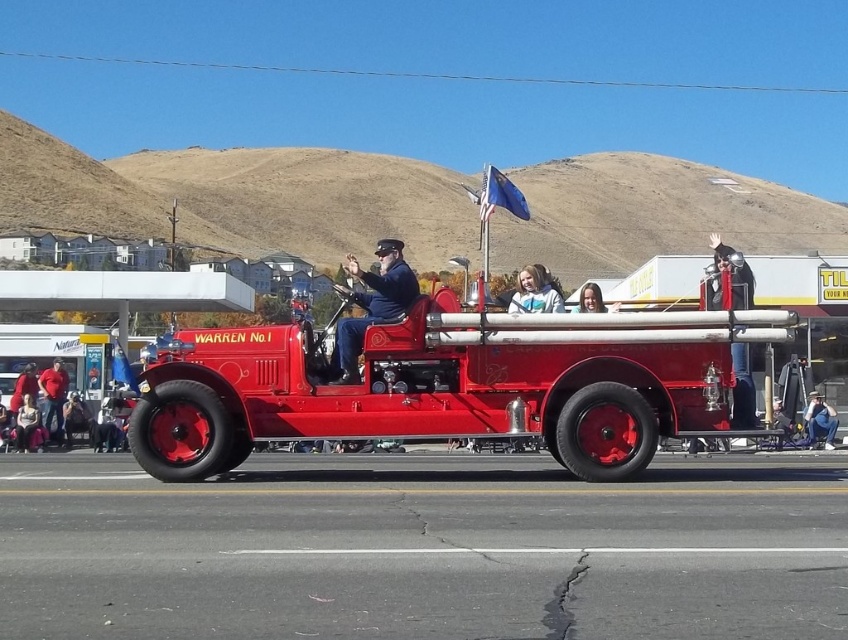
You are a photographer at the parade. You want to capture a photo of the smooth skin face at center without the denim pants at lower right appearing in the background. Is this possible?

The smooth skin face at center is behind denim pants at lower right, so taking a photo of the smooth skin face at center without the denim pants at lower right in the background is not possible.

You are a photographer trying to capture the shiny red fire truck at center and the matte black uniform at center in a single photo. Given that your camera can only focus on objects within a 100cm width, will both objects fit in the frame if they are positioned side by side?

The shiny red fire truck at center is bigger than the matte black uniform at center. Since the camera can focus on objects within 100cm width, both objects can fit in the frame as their combined size is less than 100cm.

You are a photographer trying to capture a photo of the shiny red fire truck at center and the matte black uniform at center during the parade. Based on their positions, which object is located more to the left?

The shiny red fire truck at center is positioned on the left side of matte black uniform at center, so the shiny red fire truck at center is more to the left.